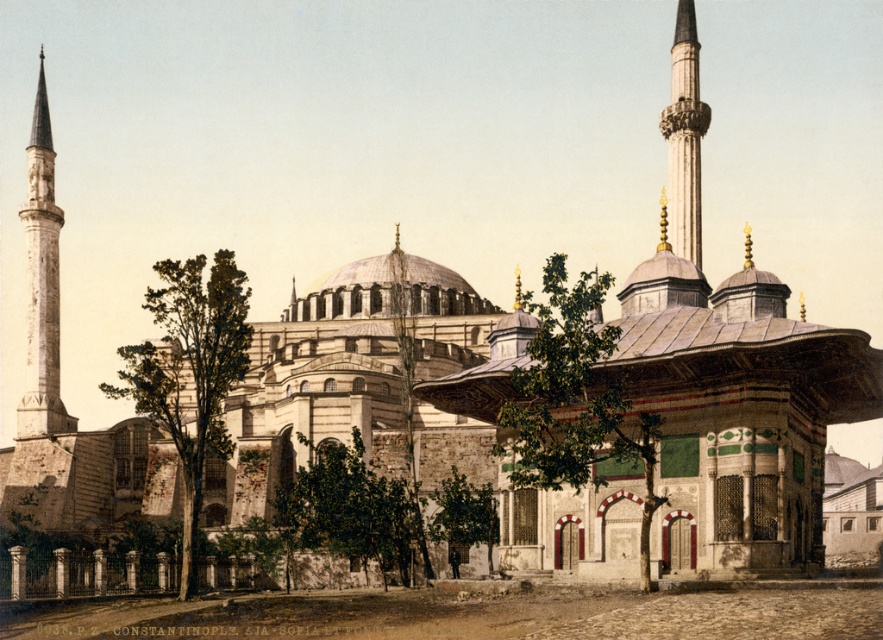
Question: Does white marble minaret at left have a smaller size compared to white marble minaret at upper center?

Choices:
 (A) no
 (B) yes

Answer: (B)

Question: Does smooth stone pillar at lower left appear on the right side of smooth stone pillar at center?

Choices:
 (A) no
 (B) yes

Answer: (A)

Question: Is white marble minaret at left thinner than smooth stone pillar at center?

Choices:
 (A) yes
 (B) no

Answer: (B)

Question: Which point is closer to the camera?

Choices:
 (A) white marble minaret at left
 (B) smooth stone pillar at lower left
 (C) dark brown stone pillar at center

Answer: (B)

Question: Which point is farther to the camera?

Choices:
 (A) smooth stone pillar at center
 (B) white marble minaret at left
 (C) dark brown stone pillar at center

Answer: (B)

Question: Which is farther from the smooth stone pillar at lower left?

Choices:
 (A) dark brown stone pillar at center
 (B) white marble minaret at upper center
 (C) white marble minaret at left
 (D) smooth stone pillar at center

Answer: (B)